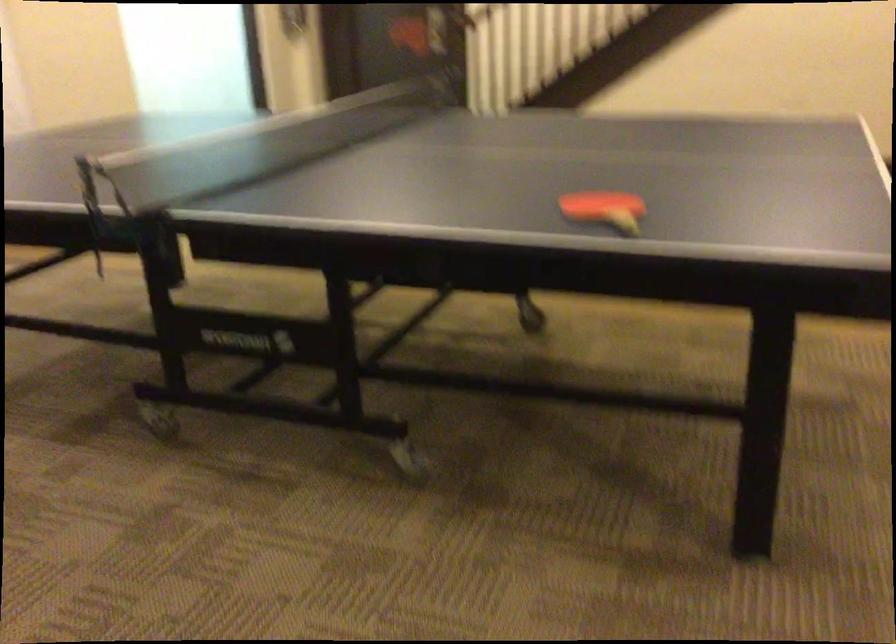
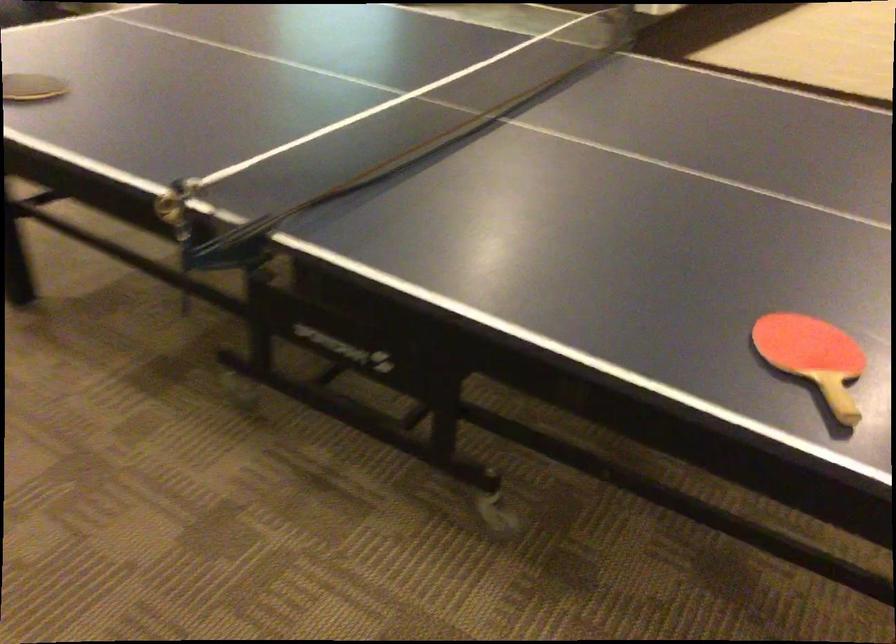
In the second image, find the point that corresponds to pixel 604 202 in the first image.

(813, 357)